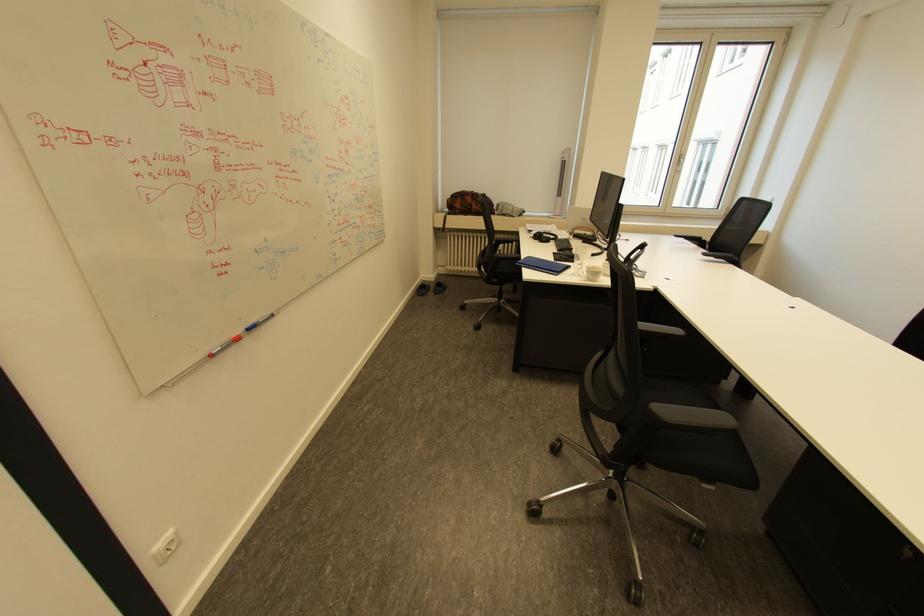
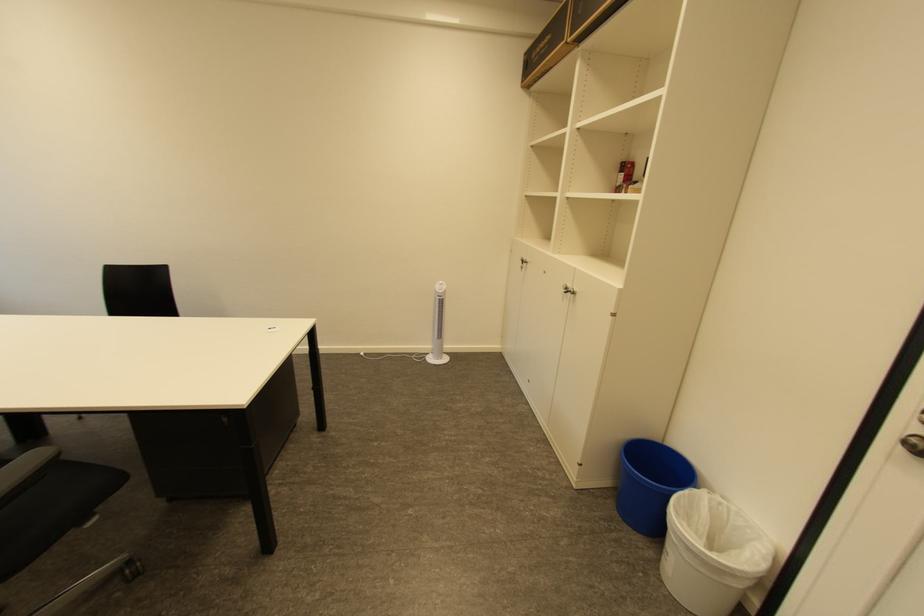
How did the camera likely rotate?

The camera's rotation is toward right-down.